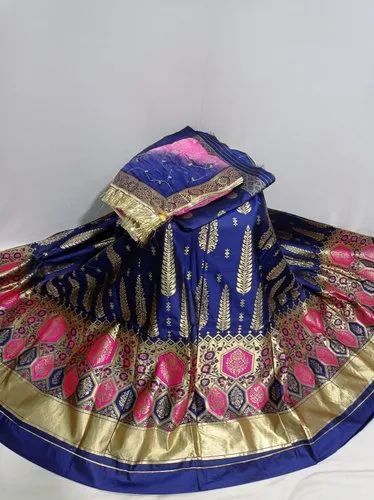
Locate an element on the screen. tassled end of folded fabric is located at coordinates (140, 216).